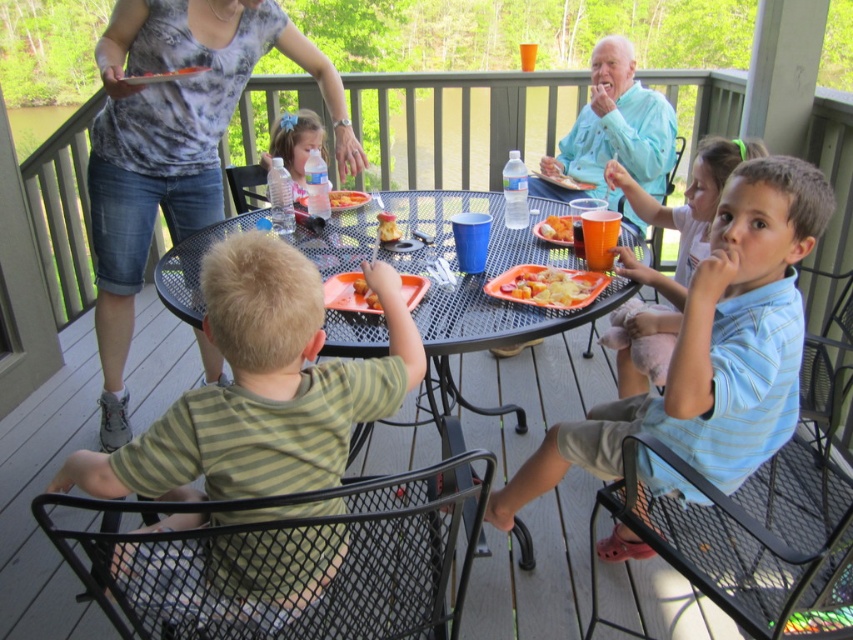
Can you confirm if matte plastic water bottle at center is positioned above yellow matte food at center?

Yes, matte plastic water bottle at center is above yellow matte food at center.

Which of these two, matte plastic water bottle at center or yellow matte food at center, stands taller?

With more height is matte plastic water bottle at center.

In the scene shown: Measure the distance between matte plastic water bottle at center and camera.

A distance of 2.59 meters exists between matte plastic water bottle at center and camera.

Locate an element on the screen. matte plastic water bottle at center is located at coordinates (294, 145).

Can you confirm if blue striped shirt at center is thinner than gray tie-dye shirt at upper left?

Yes, blue striped shirt at center is thinner than gray tie-dye shirt at upper left.

You are a GUI agent. You are given a task and a screenshot of the screen. Output one action in this format:
    pyautogui.click(x=<x>, y=<y>)
    Task: Click on the blue striped shirt at center
    
    Given the screenshot: What is the action you would take?
    pyautogui.click(x=711, y=348)

Is green striped shirt at lower left to the right of gray tie-dye shirt at upper left from the viewer's perspective?

Correct, you'll find green striped shirt at lower left to the right of gray tie-dye shirt at upper left.

Which is below, green striped shirt at lower left or gray tie-dye shirt at upper left?

green striped shirt at lower left

Between point (340, 397) and point (169, 182), which one is positioned in front?

Point (340, 397) is in front.

Where is `green striped shirt at lower left`? Image resolution: width=853 pixels, height=640 pixels. green striped shirt at lower left is located at coordinates (262, 387).